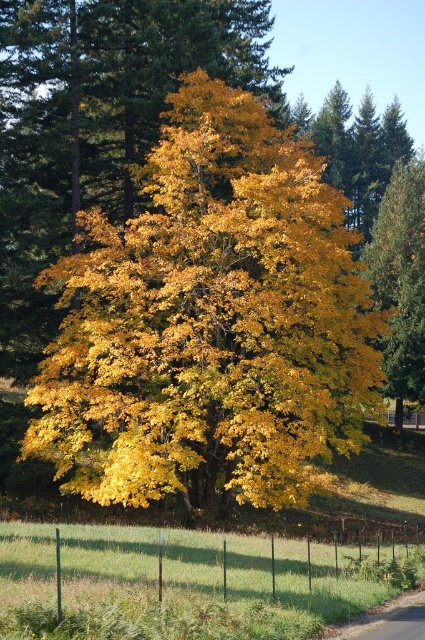
Which is behind, point (130, 472) or point (408, 300)?

The point (408, 300) is more distant.

Consider the image. Is golden yellow leaves at center further to the viewer compared to yellow matte tree at right?

No, golden yellow leaves at center is closer to the viewer.

Which is behind, point (328, 326) or point (385, 352)?

Positioned behind is point (385, 352).

Where is `golden yellow leaves at center`? The image size is (425, 640). golden yellow leaves at center is located at coordinates coord(210,321).

This screenshot has width=425, height=640. Identify the location of green wire fence at lower center. (107, 563).

Does green wire fence at lower center have a lesser height compared to yellow matte tree at right?

Yes.

Is point (11, 556) farther from camera compared to point (379, 236)?

That is False.

What are the coordinates of `green wire fence at lower center` in the screenshot? It's located at (107, 563).

Does golden yellow leaves at center lie in front of green wire fence at lower center?

No, golden yellow leaves at center is further to the viewer.

Is golden yellow leaves at center taller than green wire fence at lower center?

Indeed, golden yellow leaves at center has a greater height compared to green wire fence at lower center.

Who is more forward, (342, 426) or (11, 554)?

Point (11, 554)

Locate an element on the screen. Image resolution: width=425 pixels, height=640 pixels. golden yellow leaves at center is located at coordinates (210, 321).